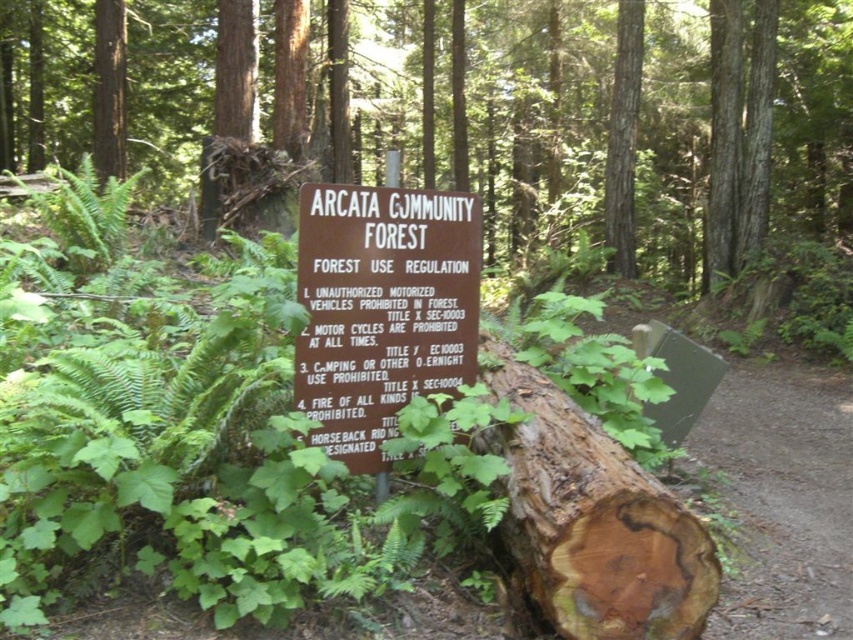
You are a hiker who wants to place a small tent near the brown wooden sign at center and the brown rough bark log at center. According to the sign, is camping allowed in this area?

The sign states that camping or other overnight use is prohibited, so you cannot place a tent for camping near the brown wooden sign at center and the brown rough bark log at center.

You are standing in the Arcata Community Forest and want to locate the brown wooden sign at center. According to the coordinates provided, where should you look to find it?

The brown wooden sign at center is located at point (381, 308).